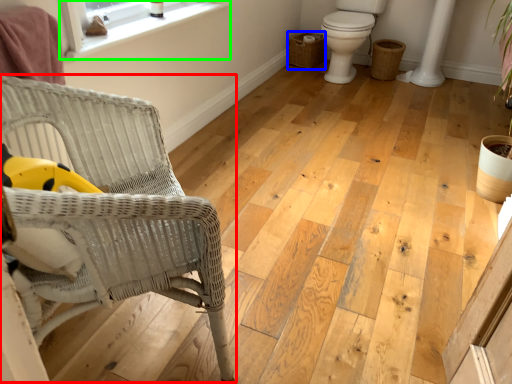
Question: Which object is positioned closest to chair (highlighted by a red box)? Select from basket (highlighted by a blue box) and window (highlighted by a green box).

Choices:
 (A) basket
 (B) window

Answer: (B)